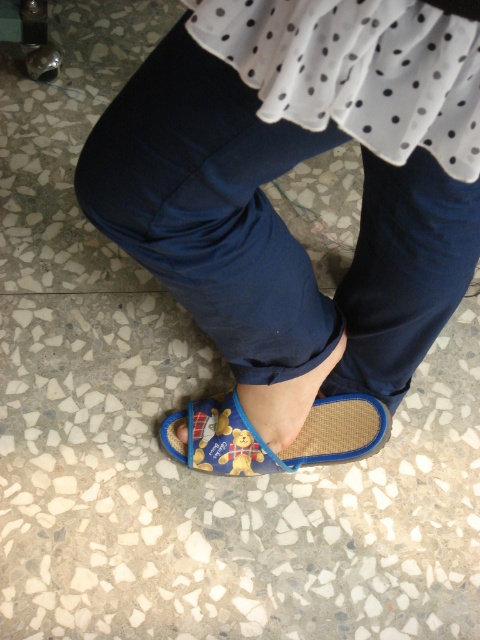
You are a fashion designer observing the image. You need to determine which item of clothing is bigger in size between the blue fabric pants at lower center and the blue fabric toe at lower center. Which one is larger?

The blue fabric pants at lower center has a larger size compared to the blue fabric toe at lower center, so the blue fabric pants at lower center is bigger in size.

You are standing at point (176, 428) and want to walk towards the direction of point (450, 20). Which direction should you face to move towards that point?

You should face towards the direction of point (450, 20) to move towards it from point (176, 428).